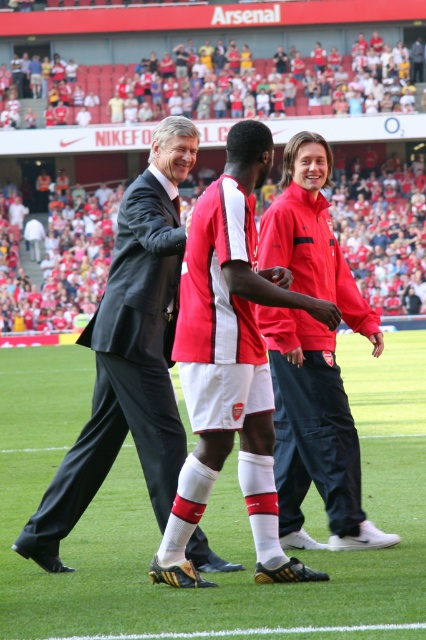
Describe the element at coordinates (239, 337) in the screenshot. The image size is (426, 640). I see `red matte jersey at center` at that location.

Does red matte jersey at center appear on the left side of red matte soccer jersey at center?

Incorrect, red matte jersey at center is not on the left side of red matte soccer jersey at center.

Between point (146, 428) and point (328, 301), which one is positioned in front?

Point (328, 301)

You are a GUI agent. You are given a task and a screenshot of the screen. Output one action in this format:
    pyautogui.click(x=<x>, y=<y>)
    Task: Click on the red matte jersey at center
    The image size is (426, 640).
    Given the screenshot: What is the action you would take?
    [239, 337]

Can you confirm if red matte soccer jersey at center is positioned above red matte jacket at center?

Actually, red matte soccer jersey at center is below red matte jacket at center.

Between red matte soccer jersey at center and red matte jacket at center, which one appears on the right side from the viewer's perspective?

Positioned to the right is red matte jacket at center.

Locate an element on the screen. This screenshot has height=640, width=426. red matte soccer jersey at center is located at coordinates (230, 364).

Measure the distance between red matte jersey at center and camera.

red matte jersey at center and camera are 7.06 meters apart from each other.

Is red matte jersey at center to the left of red matte jacket at center from the viewer's perspective?

Indeed, red matte jersey at center is positioned on the left side of red matte jacket at center.

The height and width of the screenshot is (640, 426). Describe the element at coordinates (239, 337) in the screenshot. I see `red matte jersey at center` at that location.

This screenshot has width=426, height=640. Identify the location of red matte jersey at center. (239, 337).